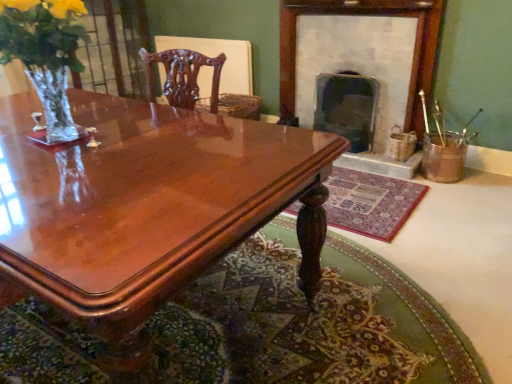
In order to face clear glass vase at left, should I rotate leftwards or rightwards?

A 26.277 degree turn to the left will do.

This screenshot has width=512, height=384. What are the coordinates of `carpeted mat at lower center, the 1th mat from the top` in the screenshot? It's located at (370, 202).

In order to face carpeted rug at center, positioned as the second mat in top-to-bottom order, should I rotate leftwards or rightwards?

Turn left by 1.113 degrees to look at carpeted rug at center, positioned as the second mat in top-to-bottom order.

Measure the distance between point (72, 210) and camera.

Point (72, 210) is 1.09 meters from camera.

This screenshot has height=384, width=512. Describe the element at coordinates (183, 76) in the screenshot. I see `mahogany wood chair at upper center` at that location.

You are a GUI agent. You are given a task and a screenshot of the screen. Output one action in this format:
    pyautogui.click(x=<x>, y=<y>)
    Task: Click on the clear glass vase at left
    The height and width of the screenshot is (384, 512).
    Given the screenshot: What is the action you would take?
    [x=46, y=54]

Is mahogany wood chair at upper center taller than dark gray stone fireplace at center, acting as the 2th fireplace starting from the left?

Indeed, mahogany wood chair at upper center has a greater height compared to dark gray stone fireplace at center, acting as the 2th fireplace starting from the left.

Is mahogany wood chair at upper center bigger or smaller than dark gray stone fireplace at center, acting as the 2th fireplace starting from the left?

Considering their sizes, mahogany wood chair at upper center takes up less space than dark gray stone fireplace at center, acting as the 2th fireplace starting from the left.

Is mahogany wood chair at upper center directly adjacent to dark gray stone fireplace at center, arranged as the first fireplace when viewed from the right?

No, mahogany wood chair at upper center is not touching dark gray stone fireplace at center, arranged as the first fireplace when viewed from the right.

Is carpeted mat at lower center, the second mat from the bottom, turned away from shiny brown wood coffee table at center?

No, carpeted mat at lower center, the second mat from the bottom, is not facing away from shiny brown wood coffee table at center.

Are carpeted mat at lower center, the 1th mat from the top, and shiny brown wood coffee table at center far apart?

Yes, carpeted mat at lower center, the 1th mat from the top, is far from shiny brown wood coffee table at center.

From the image's perspective, does carpeted mat at lower center, the second mat from the bottom, appear higher than shiny brown wood coffee table at center?

Yes, from the image's perspective, carpeted mat at lower center, the second mat from the bottom, is over shiny brown wood coffee table at center.

Considering the sizes of objects shiny brown wood coffee table at center and carpeted rug at center, marked as the first mat in a bottom-to-top arrangement, in the image provided, who is smaller, shiny brown wood coffee table at center or carpeted rug at center, marked as the first mat in a bottom-to-top arrangement,?

Smaller between the two is carpeted rug at center, marked as the first mat in a bottom-to-top arrangement.

Where is `mat below the shiny brown wood coffee table at center (from the image's perspective)`? The width and height of the screenshot is (512, 384). mat below the shiny brown wood coffee table at center (from the image's perspective) is located at coordinates (265, 327).

From a real-world perspective, does shiny brown wood coffee table at center sit lower than carpeted rug at center, positioned as the second mat in top-to-bottom order?

No, from a real-world perspective, shiny brown wood coffee table at center is not below carpeted rug at center, positioned as the second mat in top-to-bottom order.

Between shiny brown wood coffee table at center and carpeted rug at center, marked as the first mat in a bottom-to-top arrangement, which one has more height?

shiny brown wood coffee table at center is taller.

Does point (148, 69) come farther from viewer compared to point (393, 50)?

Yes, point (148, 69) is farther from viewer.

Starting from the mahogany wood chair at upper center, which fireplace is the 2nd one in front? Please provide its 2D coordinates.

[(364, 52)]

Between mahogany wood chair at upper center and smooth stone fireplace at upper right, which ranks as the 2th fireplace in right-to-left order, which one has smaller width?

With smaller width is smooth stone fireplace at upper right, which ranks as the 2th fireplace in right-to-left order.

Is carpeted rug at center, positioned as the second mat in top-to-bottom order, to the left of mahogany wood chair at upper center from the viewer's perspective?

In fact, carpeted rug at center, positioned as the second mat in top-to-bottom order, is to the right of mahogany wood chair at upper center.

Consider the image. Considering the sizes of carpeted rug at center, positioned as the second mat in top-to-bottom order, and mahogany wood chair at upper center in the image, is carpeted rug at center, positioned as the second mat in top-to-bottom order, wider or thinner than mahogany wood chair at upper center?

Clearly, carpeted rug at center, positioned as the second mat in top-to-bottom order, has more width compared to mahogany wood chair at upper center.

From a real-world perspective, is carpeted rug at center, marked as the first mat in a bottom-to-top arrangement, positioned under mahogany wood chair at upper center based on gravity?

Yes, from a real-world perspective, carpeted rug at center, marked as the first mat in a bottom-to-top arrangement, is below mahogany wood chair at upper center.

Considering the relative positions of carpeted rug at center, marked as the first mat in a bottom-to-top arrangement, and mahogany wood chair at upper center in the image provided, is carpeted rug at center, marked as the first mat in a bottom-to-top arrangement, in front of mahogany wood chair at upper center?

Yes, carpeted rug at center, marked as the first mat in a bottom-to-top arrangement, is closer to the viewer.

Does point (336, 196) lie behind point (286, 93)?

No.

Considering the relative sizes of carpeted mat at lower center, the 1th mat from the top, and smooth stone fireplace at upper right, which ranks as the 2th fireplace in right-to-left order, in the image provided, is carpeted mat at lower center, the 1th mat from the top, smaller than smooth stone fireplace at upper right, which ranks as the 2th fireplace in right-to-left order,?

Yes, carpeted mat at lower center, the 1th mat from the top, is smaller than smooth stone fireplace at upper right, which ranks as the 2th fireplace in right-to-left order.

Is carpeted mat at lower center, the 1th mat from the top, placed right next to smooth stone fireplace at upper right, which ranks as the 2th fireplace in right-to-left order?

They are not placed beside each other.

Between clear glass vase at left and carpeted rug at center, marked as the first mat in a bottom-to-top arrangement, which one has smaller width?

clear glass vase at left is thinner.

Is point (65, 65) closer to viewer compared to point (8, 356)?

Yes, point (65, 65) is closer to viewer.

From the image's perspective, which one is positioned lower, clear glass vase at left or carpeted rug at center, positioned as the second mat in top-to-bottom order?

carpeted rug at center, positioned as the second mat in top-to-bottom order.

Identify the location of the 2nd mat below when counting from the clear glass vase at left (from the image's perspective). (265, 327).

What are the coordinates of `chair above the dark gray stone fireplace at center, acting as the 2th fireplace starting from the left (from the image's perspective)` in the screenshot? It's located at (183, 76).

Find the location of a particular element. coffee table above the carpeted mat at lower center, the 1th mat from the top (from a real-world perspective) is located at coordinates (147, 207).

Based on their spatial positions, is carpeted mat at lower center, the 1th mat from the top, or shiny brown wood coffee table at center further from clear glass vase at left?

carpeted mat at lower center, the 1th mat from the top, lies further to clear glass vase at left than the other object.

From the image, which object appears to be farther from clear glass vase at left, dark gray stone fireplace at center, arranged as the first fireplace when viewed from the right, or mahogany wood chair at upper center?

Among the two, dark gray stone fireplace at center, arranged as the first fireplace when viewed from the right, is located further to clear glass vase at left.

Based on their spatial positions, is mahogany wood chair at upper center or smooth stone fireplace at upper right, which ranks as the 1th fireplace in left-to-right order, further from carpeted rug at center, positioned as the second mat in top-to-bottom order?

The object further to carpeted rug at center, positioned as the second mat in top-to-bottom order, is smooth stone fireplace at upper right, which ranks as the 1th fireplace in left-to-right order.

Estimate the real-world distances between objects in this image. Which object is closer to smooth stone fireplace at upper right, which ranks as the 2th fireplace in right-to-left order, carpeted mat at lower center, the second mat from the bottom, or mahogany wood chair at upper center?

Based on the image, carpeted mat at lower center, the second mat from the bottom, appears to be nearer to smooth stone fireplace at upper right, which ranks as the 2th fireplace in right-to-left order.

From the image, which object appears to be farther from carpeted mat at lower center, the second mat from the bottom, clear glass vase at left or mahogany wood chair at upper center?

clear glass vase at left.

Estimate the real-world distances between objects in this image. Which object is closer to shiny brown wood coffee table at center, dark gray stone fireplace at center, acting as the 2th fireplace starting from the left, or mahogany wood chair at upper center?

The object closer to shiny brown wood coffee table at center is mahogany wood chair at upper center.

Which object lies nearer to the anchor point mahogany wood chair at upper center, shiny brown wood coffee table at center or smooth stone fireplace at upper right, which ranks as the 2th fireplace in right-to-left order?

Based on the image, shiny brown wood coffee table at center appears to be nearer to mahogany wood chair at upper center.

Estimate the real-world distances between objects in this image. Which object is closer to carpeted mat at lower center, the 1th mat from the top, mahogany wood chair at upper center or carpeted rug at center, positioned as the second mat in top-to-bottom order?

The object closer to carpeted mat at lower center, the 1th mat from the top, is carpeted rug at center, positioned as the second mat in top-to-bottom order.

You are a GUI agent. You are given a task and a screenshot of the screen. Output one action in this format:
    pyautogui.click(x=<x>, y=<y>)
    Task: Click on the floral arrangement between carpeted rug at center, positioned as the second mat in top-to-bottom order, and carpeted mat at lower center, the 1th mat from the top, along the z-axis
    Image resolution: width=512 pixels, height=384 pixels.
    Given the screenshot: What is the action you would take?
    pyautogui.click(x=46, y=54)

Where is `mat positioned between clear glass vase at left and dark gray stone fireplace at center, arranged as the first fireplace when viewed from the right, from near to far`? This screenshot has height=384, width=512. mat positioned between clear glass vase at left and dark gray stone fireplace at center, arranged as the first fireplace when viewed from the right, from near to far is located at coordinates (370, 202).

Image resolution: width=512 pixels, height=384 pixels. I want to click on mat located between clear glass vase at left and mahogany wood chair at upper center in the depth direction, so click(370, 202).

Where is `floral arrangement between carpeted rug at center, positioned as the second mat in top-to-bottom order, and smooth stone fireplace at upper right, which ranks as the 2th fireplace in right-to-left order, along the z-axis`? The height and width of the screenshot is (384, 512). floral arrangement between carpeted rug at center, positioned as the second mat in top-to-bottom order, and smooth stone fireplace at upper right, which ranks as the 2th fireplace in right-to-left order, along the z-axis is located at coordinates (46, 54).